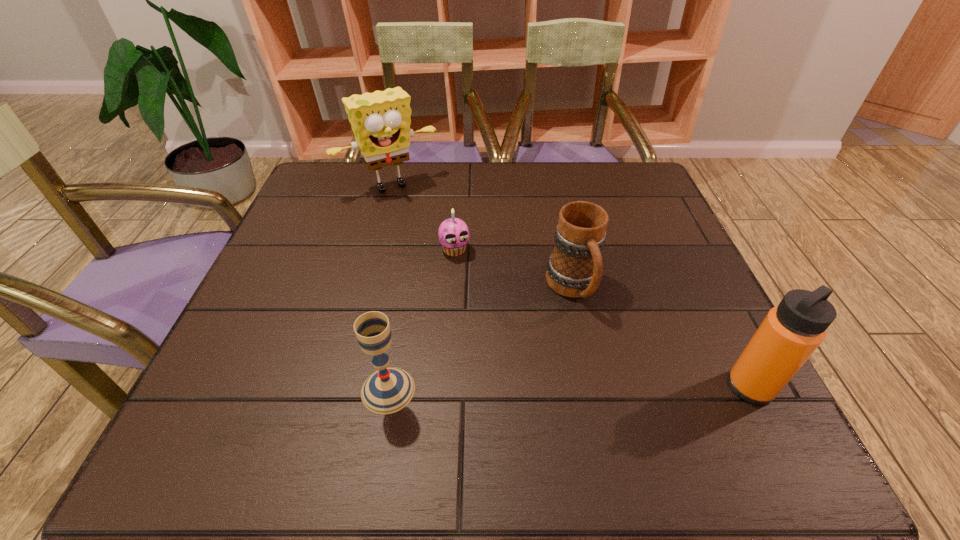
The width and height of the screenshot is (960, 540). What are the coordinates of `vacant space on the desktop that is between the chalice and the rightmost object and is positioned on the face of the second farthest object` in the screenshot? It's located at (518, 389).

The image size is (960, 540). In order to click on free spot on the desktop that is between the chalice and the rightmost object and is positioned on the front-facing side of the farthest object in this screenshot , I will do `click(534, 389)`.

At what (x,y) coordinates should I click in order to perform the action: click on free spot on the desktop that is between the chalice and the rightmost object and is positioned on the side of the second object from right to left with the handle. Please return your answer as a coordinate pair (x, y). Looking at the image, I should click on (623, 388).